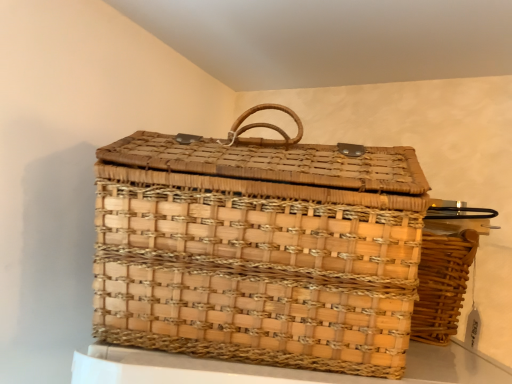
Where is `natural woven picnic basket at right, which appears as the 2th picnic basket when viewed from the left`? Image resolution: width=512 pixels, height=384 pixels. natural woven picnic basket at right, which appears as the 2th picnic basket when viewed from the left is located at coordinates (442, 284).

What do you see at coordinates (442, 284) in the screenshot? I see `natural woven picnic basket at right, which appears as the 2th picnic basket when viewed from the left` at bounding box center [442, 284].

Locate an element on the screen. The image size is (512, 384). natural woven picnic basket at center, which appears as the 2th picnic basket when viewed from the right is located at coordinates click(259, 249).

The height and width of the screenshot is (384, 512). What do you see at coordinates (259, 249) in the screenshot?
I see `natural woven picnic basket at center, which ranks as the 1th picnic basket in left-to-right order` at bounding box center [259, 249].

In order to face natural woven picnic basket at center, which appears as the 2th picnic basket when viewed from the right, should I rotate leftwards or rightwards?

Turn right approximately 1.043 degrees to face it.

How much space does natural woven picnic basket at center, which appears as the 2th picnic basket when viewed from the right, occupy horizontally?

It is 9.62 inches.

The image size is (512, 384). In order to click on natural woven picnic basket at right, acting as the 1th picnic basket starting from the right in this screenshot , I will do `click(442, 284)`.

Considering the relative positions of natural woven picnic basket at center, which appears as the 2th picnic basket when viewed from the right, and natural woven picnic basket at right, which appears as the 2th picnic basket when viewed from the left, in the image provided, is natural woven picnic basket at center, which appears as the 2th picnic basket when viewed from the right, to the left of natural woven picnic basket at right, which appears as the 2th picnic basket when viewed from the left, from the viewer's perspective?

Correct, you'll find natural woven picnic basket at center, which appears as the 2th picnic basket when viewed from the right, to the left of natural woven picnic basket at right, which appears as the 2th picnic basket when viewed from the left.

Does natural woven picnic basket at center, which ranks as the 1th picnic basket in left-to-right order, come in front of natural woven picnic basket at right, acting as the 1th picnic basket starting from the right?

Yes, natural woven picnic basket at center, which ranks as the 1th picnic basket in left-to-right order, is in front of natural woven picnic basket at right, acting as the 1th picnic basket starting from the right.

Does point (254, 106) come farther from viewer compared to point (414, 318)?

No, (254, 106) is in front of (414, 318).

From the image's perspective, which one is positioned lower, natural woven picnic basket at center, which appears as the 2th picnic basket when viewed from the right, or natural woven picnic basket at right, which appears as the 2th picnic basket when viewed from the left?

natural woven picnic basket at right, which appears as the 2th picnic basket when viewed from the left, from the image's perspective.

From a real-world perspective, which is physically below, natural woven picnic basket at center, which appears as the 2th picnic basket when viewed from the right, or natural woven picnic basket at right, which appears as the 2th picnic basket when viewed from the left?

natural woven picnic basket at right, which appears as the 2th picnic basket when viewed from the left.

Does natural woven picnic basket at center, which appears as the 2th picnic basket when viewed from the right, have a lesser width compared to natural woven picnic basket at right, which appears as the 2th picnic basket when viewed from the left?

Indeed, natural woven picnic basket at center, which appears as the 2th picnic basket when viewed from the right, has a lesser width compared to natural woven picnic basket at right, which appears as the 2th picnic basket when viewed from the left.

Who is taller, natural woven picnic basket at center, which ranks as the 1th picnic basket in left-to-right order, or natural woven picnic basket at right, which appears as the 2th picnic basket when viewed from the left?

natural woven picnic basket at center, which ranks as the 1th picnic basket in left-to-right order, is taller.

Can you confirm if natural woven picnic basket at center, which appears as the 2th picnic basket when viewed from the right, is bigger than natural woven picnic basket at right, which appears as the 2th picnic basket when viewed from the left?

Yes.

Is natural woven picnic basket at center, which ranks as the 1th picnic basket in left-to-right order, completely or partially outside of natural woven picnic basket at right, which appears as the 2th picnic basket when viewed from the left?

Yes, natural woven picnic basket at center, which ranks as the 1th picnic basket in left-to-right order, is outside of natural woven picnic basket at right, which appears as the 2th picnic basket when viewed from the left.

Is there a large distance between natural woven picnic basket at center, which ranks as the 1th picnic basket in left-to-right order, and natural woven picnic basket at right, which appears as the 2th picnic basket when viewed from the left?

No.

Is natural woven picnic basket at center, which appears as the 2th picnic basket when viewed from the right, looking in the opposite direction of natural woven picnic basket at right, which appears as the 2th picnic basket when viewed from the left?

No.

How distant is natural woven picnic basket at center, which appears as the 2th picnic basket when viewed from the right, from natural woven picnic basket at right, acting as the 1th picnic basket starting from the right?

A distance of 35.68 centimeters exists between natural woven picnic basket at center, which appears as the 2th picnic basket when viewed from the right, and natural woven picnic basket at right, acting as the 1th picnic basket starting from the right.

I want to click on picnic basket located on the left of natural woven picnic basket at right, which appears as the 2th picnic basket when viewed from the left, so click(259, 249).

Between natural woven picnic basket at right, acting as the 1th picnic basket starting from the right, and natural woven picnic basket at center, which appears as the 2th picnic basket when viewed from the right, which one appears on the right side from the viewer's perspective?

Positioned to the right is natural woven picnic basket at right, acting as the 1th picnic basket starting from the right.

In the image, is natural woven picnic basket at right, which appears as the 2th picnic basket when viewed from the left, positioned in front of or behind natural woven picnic basket at center, which appears as the 2th picnic basket when viewed from the right?

natural woven picnic basket at right, which appears as the 2th picnic basket when viewed from the left, is positioned farther from the viewer than natural woven picnic basket at center, which appears as the 2th picnic basket when viewed from the right.

Between point (435, 338) and point (322, 287), which one is positioned behind?

The point (435, 338) is farther from the camera.

From the image's perspective, between natural woven picnic basket at right, acting as the 1th picnic basket starting from the right, and natural woven picnic basket at center, which appears as the 2th picnic basket when viewed from the right, which one is located above?

natural woven picnic basket at center, which appears as the 2th picnic basket when viewed from the right.

Consider the image. From a real-world perspective, which is physically below, natural woven picnic basket at right, acting as the 1th picnic basket starting from the right, or natural woven picnic basket at center, which appears as the 2th picnic basket when viewed from the right?

From a 3D spatial view, natural woven picnic basket at right, acting as the 1th picnic basket starting from the right, is below.

Between natural woven picnic basket at right, acting as the 1th picnic basket starting from the right, and natural woven picnic basket at center, which appears as the 2th picnic basket when viewed from the right, which one has larger width?

With larger width is natural woven picnic basket at right, acting as the 1th picnic basket starting from the right.

Considering the sizes of objects natural woven picnic basket at right, which appears as the 2th picnic basket when viewed from the left, and natural woven picnic basket at center, which ranks as the 1th picnic basket in left-to-right order, in the image provided, who is shorter, natural woven picnic basket at right, which appears as the 2th picnic basket when viewed from the left, or natural woven picnic basket at center, which ranks as the 1th picnic basket in left-to-right order,?

Standing shorter between the two is natural woven picnic basket at right, which appears as the 2th picnic basket when viewed from the left.

Which of these two, natural woven picnic basket at right, acting as the 1th picnic basket starting from the right, or natural woven picnic basket at center, which ranks as the 1th picnic basket in left-to-right order, is bigger?

natural woven picnic basket at center, which ranks as the 1th picnic basket in left-to-right order.

Would you say natural woven picnic basket at right, which appears as the 2th picnic basket when viewed from the left, is outside natural woven picnic basket at center, which appears as the 2th picnic basket when viewed from the right?

Absolutely, natural woven picnic basket at right, which appears as the 2th picnic basket when viewed from the left, is external to natural woven picnic basket at center, which appears as the 2th picnic basket when viewed from the right.

Would you say natural woven picnic basket at right, acting as the 1th picnic basket starting from the right, is a long distance from natural woven picnic basket at center, which appears as the 2th picnic basket when viewed from the right?

No, there isn't a large distance between natural woven picnic basket at right, acting as the 1th picnic basket starting from the right, and natural woven picnic basket at center, which appears as the 2th picnic basket when viewed from the right.

Is natural woven picnic basket at right, acting as the 1th picnic basket starting from the right, oriented away from natural woven picnic basket at center, which appears as the 2th picnic basket when viewed from the right?

No, natural woven picnic basket at center, which appears as the 2th picnic basket when viewed from the right, is not at the back of natural woven picnic basket at right, acting as the 1th picnic basket starting from the right.

Identify the location of picnic basket above the natural woven picnic basket at right, which appears as the 2th picnic basket when viewed from the left (from the image's perspective). (259, 249).

Where is `picnic basket below the natural woven picnic basket at center, which appears as the 2th picnic basket when viewed from the right (from the image's perspective)`? The height and width of the screenshot is (384, 512). picnic basket below the natural woven picnic basket at center, which appears as the 2th picnic basket when viewed from the right (from the image's perspective) is located at coordinates (442, 284).

The height and width of the screenshot is (384, 512). I want to click on picnic basket located underneath the natural woven picnic basket at center, which appears as the 2th picnic basket when viewed from the right (from a real-world perspective), so click(442, 284).